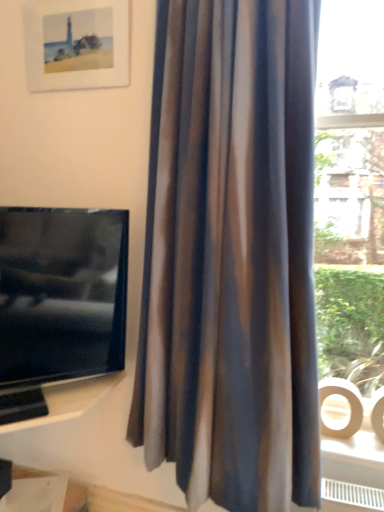
The image size is (384, 512). I want to click on free point below matte black tv at left (from a real-world perspective), so click(x=66, y=403).